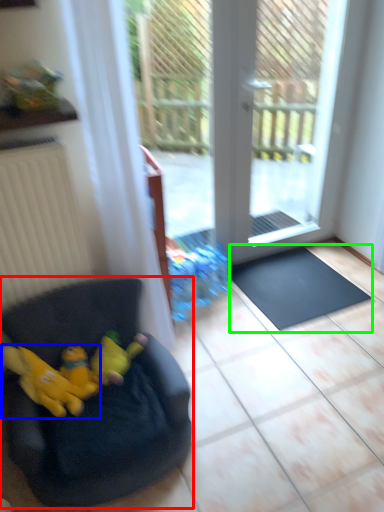
Question: Which object is the farthest from chair (highlighted by a red box)? Choose among these: animal (highlighted by a blue box) or doormat (highlighted by a green box).

Choices:
 (A) animal
 (B) doormat

Answer: (B)